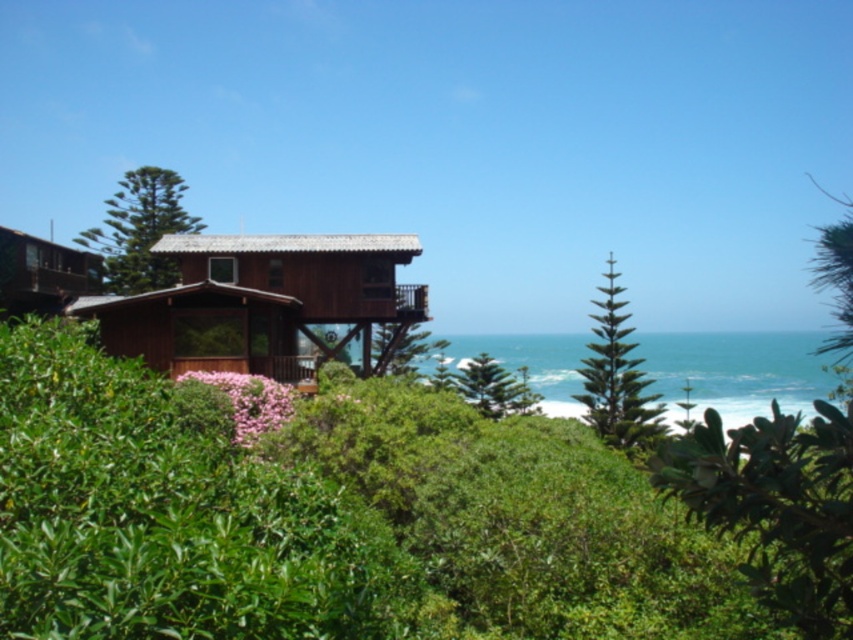
Question: Does wooden cabin at center have a larger size compared to green textured pine tree at center right?

Choices:
 (A) yes
 (B) no

Answer: (A)

Question: Does green textured pine tree at upper left appear under wooden hut at left?

Choices:
 (A) no
 (B) yes

Answer: (A)

Question: Does wooden cabin at center lie in front of wooden hut at left?

Choices:
 (A) no
 (B) yes

Answer: (B)

Question: Which point is closer to the camera?

Choices:
 (A) (833, 572)
 (B) (624, 435)
 (C) (325, 356)
 (D) (178, 214)

Answer: (A)

Question: Estimate the real-world distances between objects in this image. Which object is farther from the green leafy tree at center?

Choices:
 (A) green textured pine tree at upper left
 (B) wooden cabin at center
 (C) wooden hut at left

Answer: (A)

Question: Which object is closer to the camera taking this photo?

Choices:
 (A) green leafy tree at center
 (B) green textured pine tree at upper left
 (C) green textured pine tree at center right
 (D) wooden cabin at center

Answer: (A)